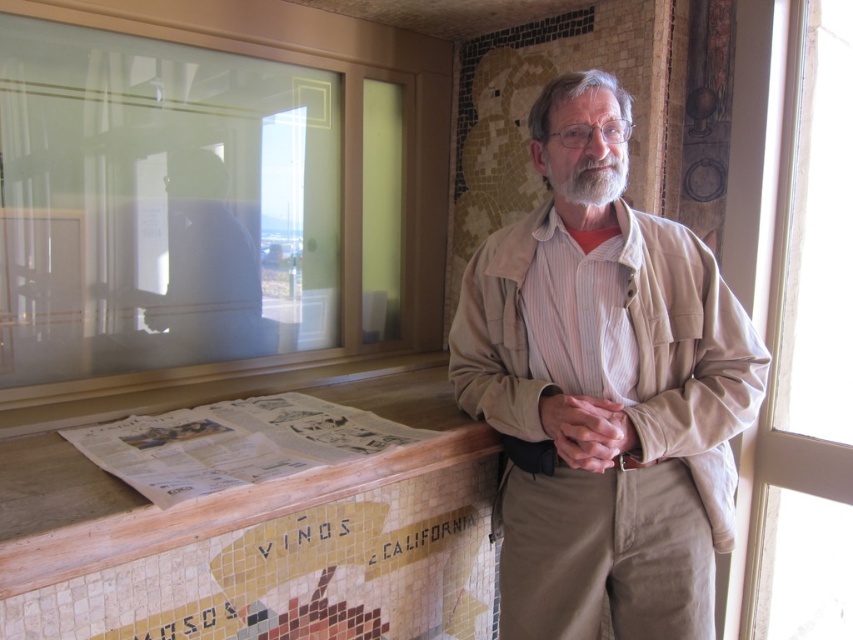
Question: Which point is closer to the camera?

Choices:
 (A) (57, 161)
 (B) (218, 438)

Answer: (B)

Question: Does wooden at lower left have a larger size compared to gray matte beard at center?

Choices:
 (A) no
 (B) yes

Answer: (B)

Question: Estimate the real-world distances between objects in this image. Which object is closer to the gray matte beard at center?

Choices:
 (A) transparent glass window at right
 (B) wooden at lower left
 (C) tan fabric jacket at center

Answer: (C)

Question: Can you confirm if frosted glass window at upper left is thinner than white printed newspaper at lower center?

Choices:
 (A) no
 (B) yes

Answer: (A)

Question: Can you confirm if frosted glass window at upper left is positioned below wooden at lower left?

Choices:
 (A) yes
 (B) no

Answer: (B)

Question: Which of these objects is positioned farthest from the tan fabric jacket at center?

Choices:
 (A) gray matte beard at center
 (B) transparent glass window at right
 (C) frosted glass window at upper left
 (D) wooden at lower left

Answer: (B)